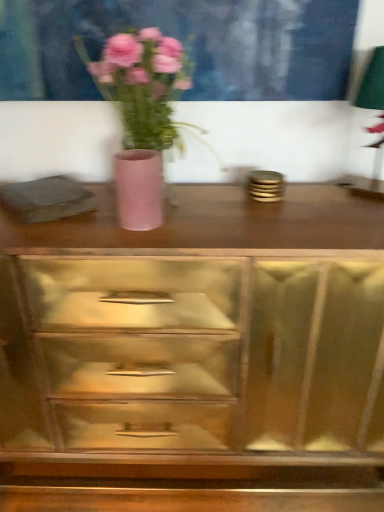
Where is `vacant space to the right of matte pink vase at center`? The image size is (384, 512). vacant space to the right of matte pink vase at center is located at coordinates (228, 230).